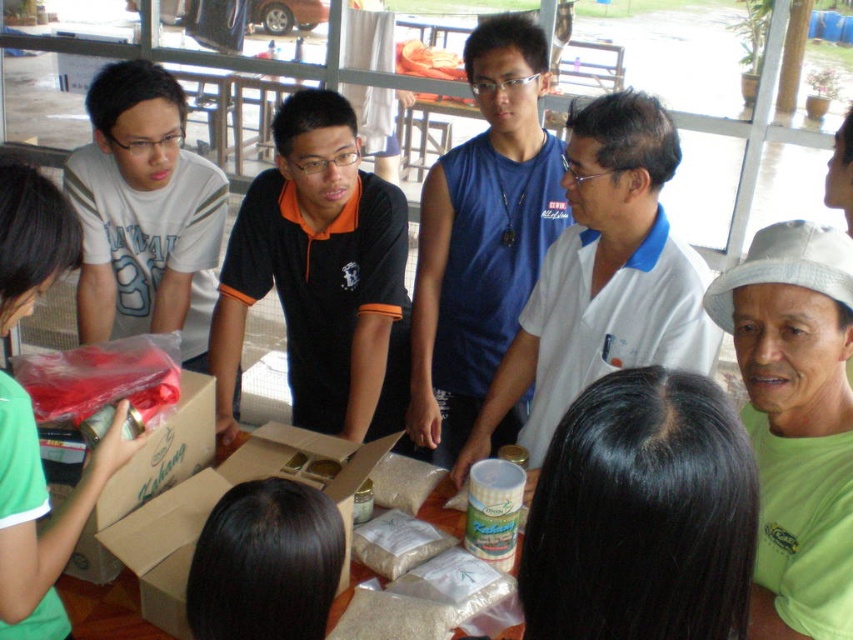
You are a delivery person who needs to place a small package on the table. The package requires a space that is at least 20 inches away from the black hair at lower center. Is the cardboard box at lower left a suitable location for placing the package?

The black hair at lower center and cardboard box at lower left are 20.66 inches apart. Since the required distance is at least 20 inches, the cardboard box at lower left is a suitable location for placing the package.

In the scene shown: You are planning to place both the brown cardboard box at center and the white matte bag at center on a shelf that can only hold items with a combined width of 50 cm. Given their widths, can both items fit together on the shelf?

The brown cardboard box at center is wider than the white matte bag at center. Since their combined widths must be less than or equal to 50 cm, but we don not know the exact widths, it is impossible to determine if they will fit without additional information.